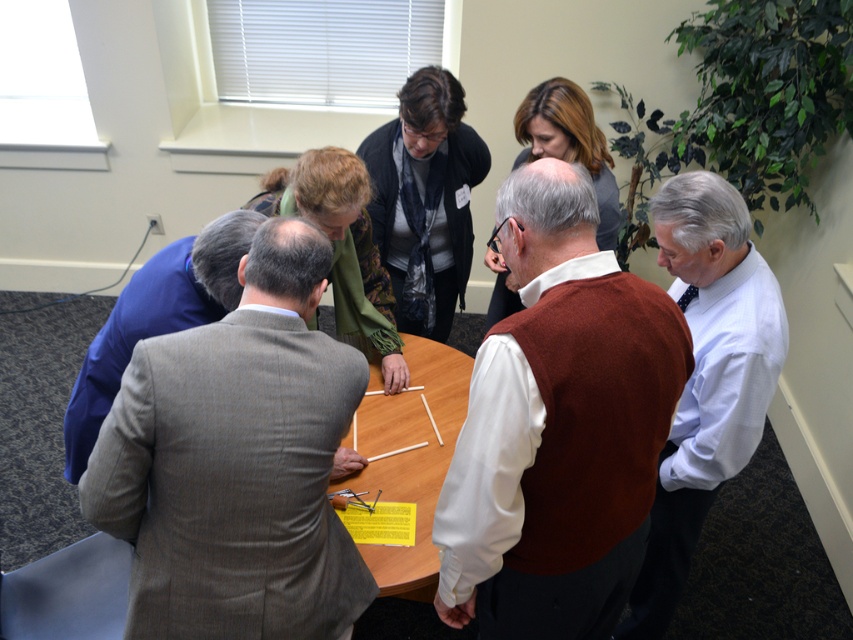
In the scene shown: Can you confirm if gray wool suit at center is thinner than white shirt at center?

Incorrect, gray wool suit at center's width is not less than white shirt at center's.

The width and height of the screenshot is (853, 640). I want to click on gray wool suit at center, so click(x=236, y=461).

Based on the photo, between brown wool vest at center and wooden at center, which one has more height?

brown wool vest at center is taller.

Who is positioned more to the left, brown wool vest at center or wooden at center?

From the viewer's perspective, wooden at center appears more on the left side.

This screenshot has width=853, height=640. In order to click on brown wool vest at center in this screenshot , I will do `click(558, 426)`.

Can you confirm if gray wool suit at center is bigger than brown wool vest at center?

No, gray wool suit at center is not bigger than brown wool vest at center.

I want to click on gray wool suit at center, so click(x=236, y=461).